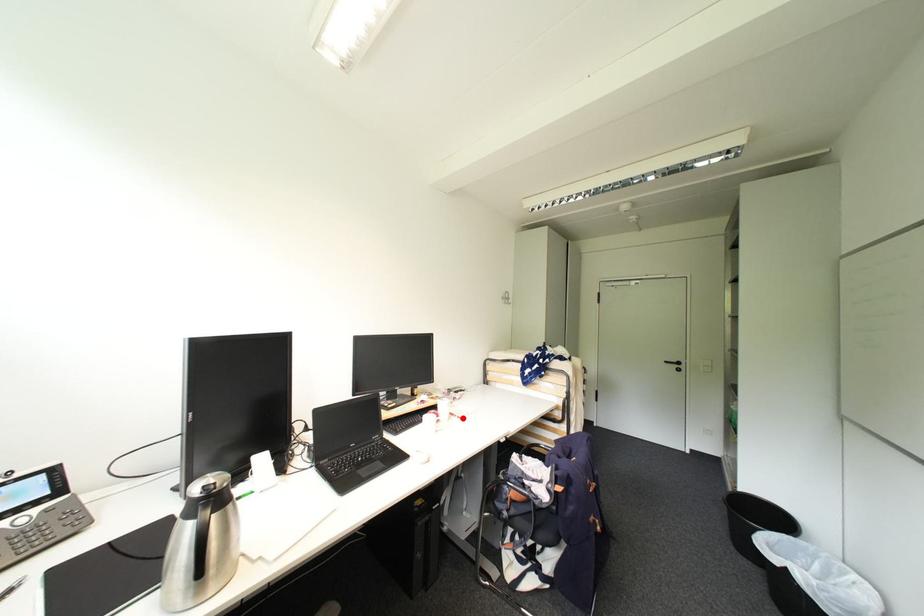
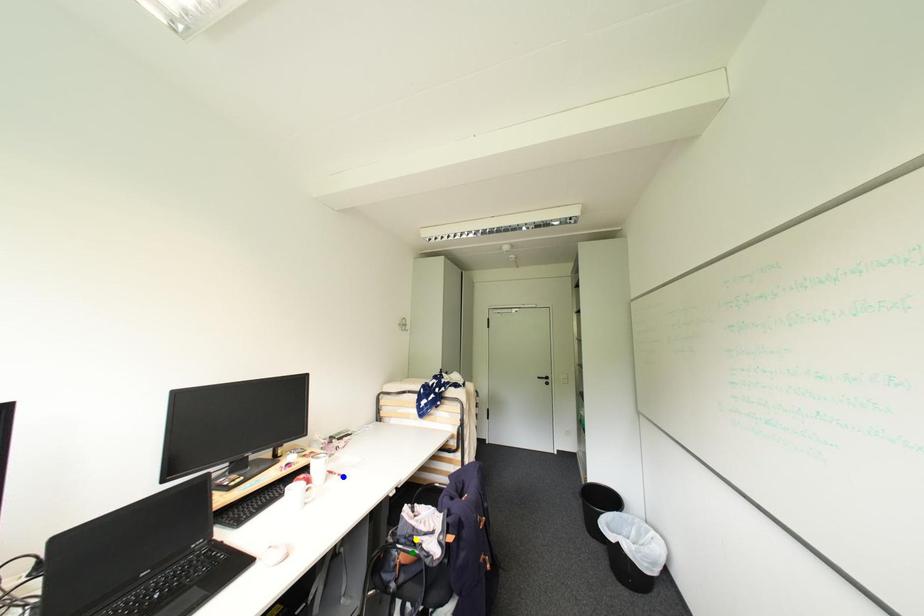
Question: I am providing you with two images of the same scene from different viewpoints. A red point is marked on the first image. You are given multiple points on the second image. In image 2, which mark is for the same physical point as the one in image 1?

Choices:
 (A) blue point
 (B) green point
 (C) yellow point

Answer: (A)